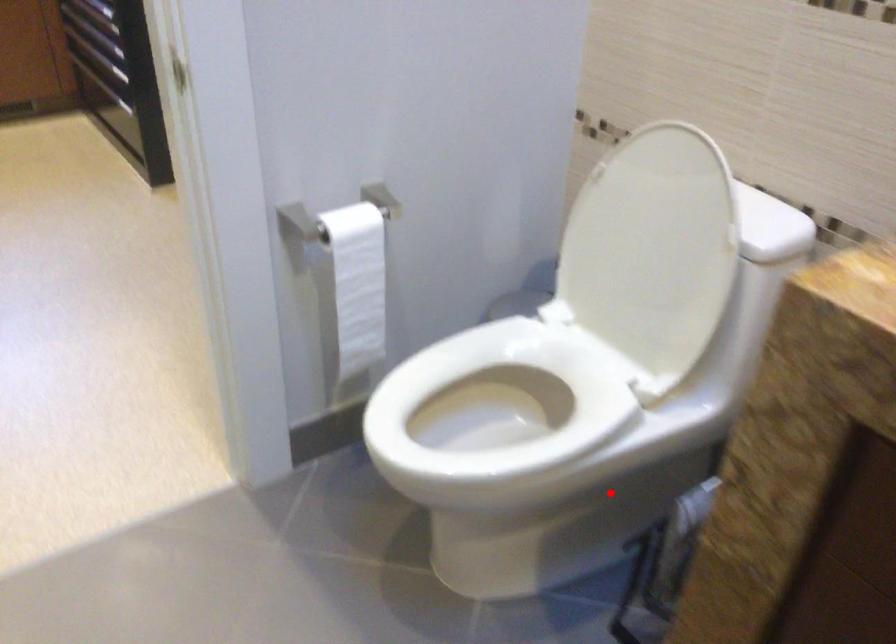
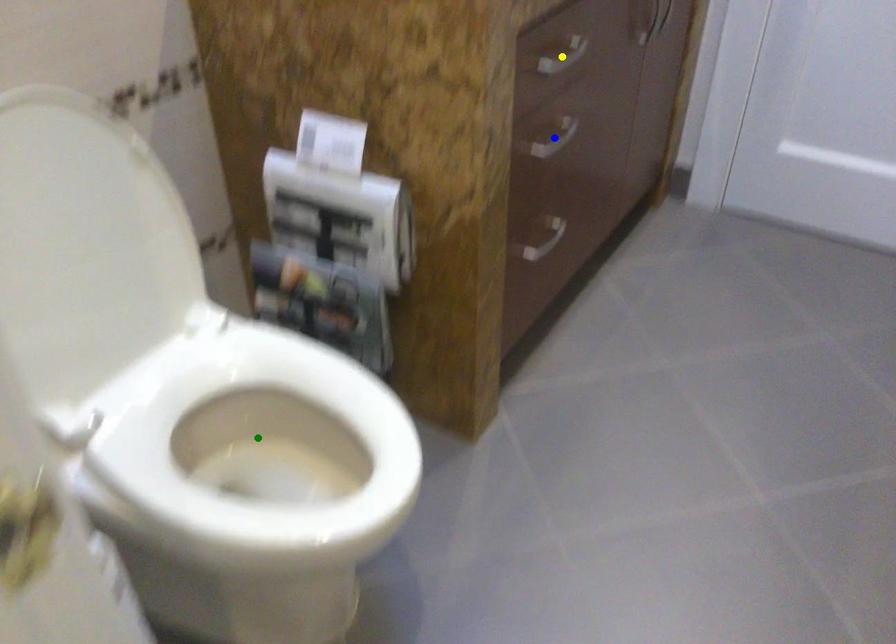
Question: I am providing you with two images of the same scene from different viewpoints. A red point is marked on the first image. You are given multiple points on the second image. Which point in image 2 is actually the same real-world point as the red point in image 1?

Choices:
 (A) yellow point
 (B) green point
 (C) blue point

Answer: (B)